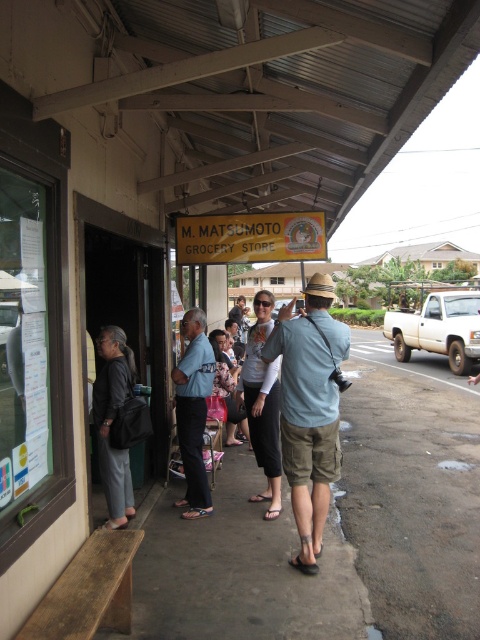
Between blue denim shirt at center and dark gray fabric pants at left, which one appears on the right side from the viewer's perspective?

blue denim shirt at center

This screenshot has height=640, width=480. In order to click on blue denim shirt at center in this screenshot , I will do `click(193, 412)`.

You are a GUI agent. You are given a task and a screenshot of the screen. Output one action in this format:
    pyautogui.click(x=<x>, y=<y>)
    Task: Click on the blue denim shirt at center
    This screenshot has width=480, height=640.
    Given the screenshot: What is the action you would take?
    coord(193,412)

Looking at this image, is light blue cotton shirt at center closer to camera compared to blue denim shirt at center?

That is True.

Is light blue cotton shirt at center shorter than blue denim shirt at center?

No.

At what (x,y) coordinates should I click in order to perform the action: click on light blue cotton shirt at center. Please return your answer as a coordinate pair (x, y). Looking at the image, I should click on (310, 410).

How much distance is there between light blue cotton shirt at center and dark gray fabric pants at left?

light blue cotton shirt at center is 4.89 feet from dark gray fabric pants at left.

Does light blue cotton shirt at center have a greater height compared to dark gray fabric pants at left?

Indeed, light blue cotton shirt at center has a greater height compared to dark gray fabric pants at left.

Which is behind, point (342, 353) or point (118, 365)?

Positioned behind is point (118, 365).

Identify the location of light blue cotton shirt at center. The height and width of the screenshot is (640, 480). pyautogui.click(x=310, y=410).